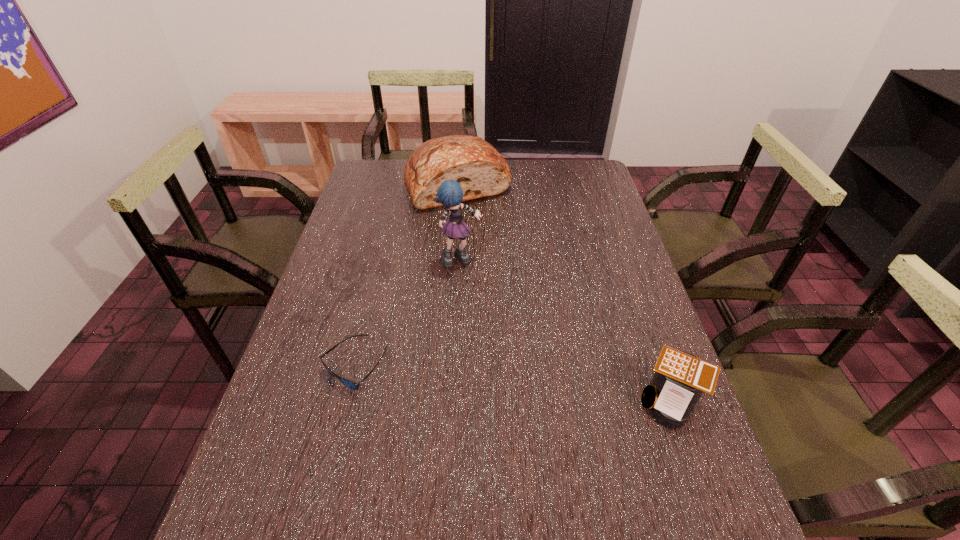
This screenshot has height=540, width=960. What are the coordinates of `sunglasses` in the screenshot? It's located at [x=348, y=383].

Identify the location of the second shortest object. This screenshot has width=960, height=540. (680, 378).

Where is `the rightmost object`? This screenshot has height=540, width=960. the rightmost object is located at coordinates (680, 378).

Locate an element on the screen. rag doll is located at coordinates coord(450,194).

This screenshot has height=540, width=960. In order to click on the third nearest object in this screenshot , I will do `click(450, 194)`.

Identify the location of bread. (476, 165).

Identify the location of the third shortest object. pyautogui.click(x=476, y=165).

At what (x,y) coordinates should I click in order to perform the action: click on vacant point located at the front of the sunglasses showing the lenses. Please return your answer as a coordinate pair (x, y). Looking at the image, I should click on (336, 440).

The width and height of the screenshot is (960, 540). I want to click on free spot located on the back of the rightmost object, so click(634, 290).

The width and height of the screenshot is (960, 540). I want to click on blank space located 0.150m on the front-facing side of the third nearest object, so click(494, 301).